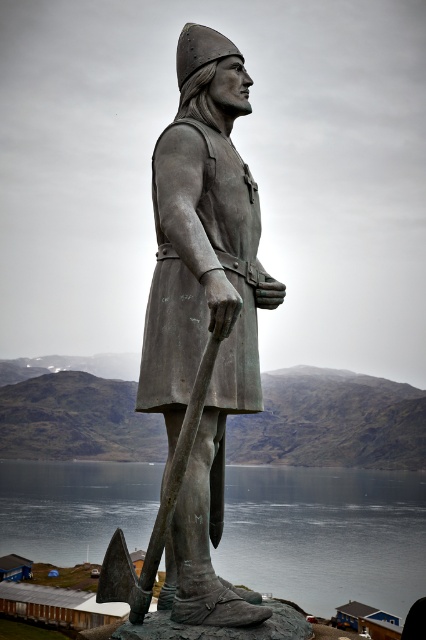
Question: Is bronze statue at center thinner than greenish-blue water at lower center?

Choices:
 (A) yes
 (B) no

Answer: (A)

Question: Is bronze statue at center smaller than bronze textured axe at center?

Choices:
 (A) yes
 (B) no

Answer: (B)

Question: Which point is farther from the camera taking this photo?

Choices:
 (A) (161, 163)
 (B) (354, 570)
 (C) (127, 561)

Answer: (B)

Question: Estimate the real-world distances between objects in this image. Which object is closer to the bronze statue at center?

Choices:
 (A) bronze textured axe at center
 (B) greenish-blue water at lower center

Answer: (A)

Question: Can you confirm if greenish-blue water at lower center is positioned below bronze textured axe at center?

Choices:
 (A) yes
 (B) no

Answer: (A)

Question: Which of the following is the farthest from the observer?

Choices:
 (A) bronze textured axe at center
 (B) greenish-blue water at lower center

Answer: (B)